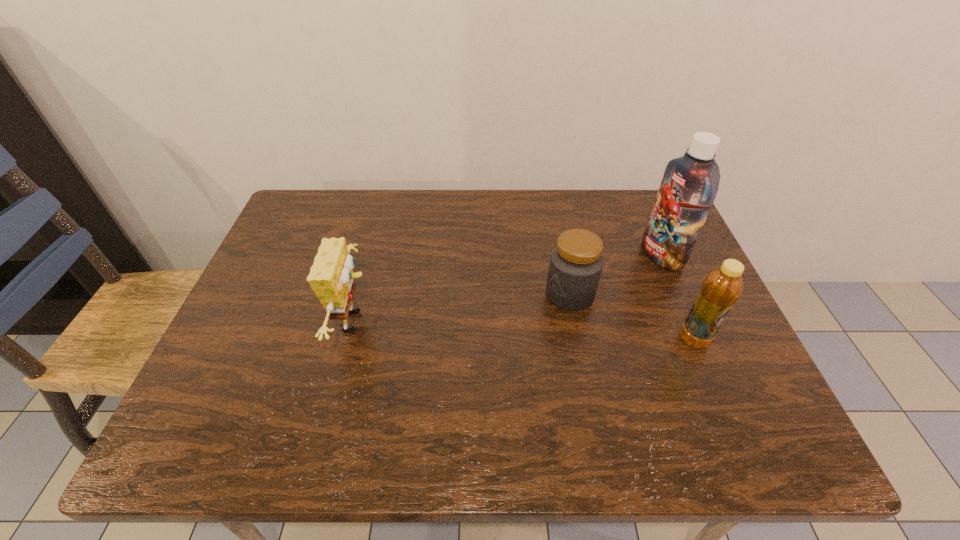
At what (x,y) coordinates should I click in order to perform the action: click on the leftmost object. Please return your answer as a coordinate pair (x, y). Looking at the image, I should click on (331, 277).

This screenshot has height=540, width=960. Identify the location of bottle. (722, 287).

Where is `the farthest object`? This screenshot has height=540, width=960. the farthest object is located at coordinates (690, 183).

Image resolution: width=960 pixels, height=540 pixels. Find the location of `the tallest object`. the tallest object is located at coordinates (690, 183).

You are a GUI agent. You are given a task and a screenshot of the screen. Output one action in this format:
    pyautogui.click(x=<x>, y=<y>)
    Task: Click on the shortest object
    Image resolution: width=960 pixels, height=540 pixels.
    Given the screenshot: What is the action you would take?
    pyautogui.click(x=576, y=263)

This screenshot has height=540, width=960. Find the location of `jar`. jar is located at coordinates (576, 263).

What are the coordinates of `vacant area situated on the face of the leftmost object` in the screenshot? It's located at (492, 321).

Find the location of a particular element. The width and height of the screenshot is (960, 540). free region located 0.130m on the front of the bottle is located at coordinates (722, 405).

You are a GUI agent. You are given a task and a screenshot of the screen. Output one action in this format:
    pyautogui.click(x=<x>, y=<y>)
    Task: Click on the free space located on the front label of the shampoo
    The width and height of the screenshot is (960, 540).
    Given the screenshot: What is the action you would take?
    pyautogui.click(x=602, y=282)

Where is `free space located 0.180m on the front label of the shampoo`? This screenshot has width=960, height=540. free space located 0.180m on the front label of the shampoo is located at coordinates (595, 285).